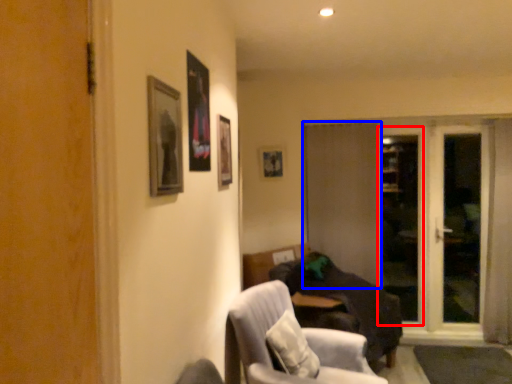
Question: Which point is closer to the camera, screen door (highlighted by a red box) or door (highlighted by a blue box)?

Choices:
 (A) screen door
 (B) door

Answer: (B)